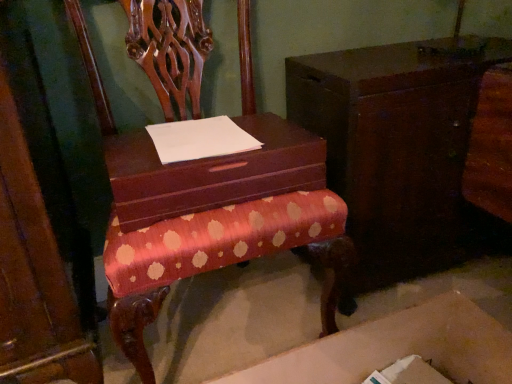
This screenshot has width=512, height=384. What are the coordinates of `matte brown shoe box at center` in the screenshot? It's located at (211, 172).

Measure the distance between point (459, 317) and camera.

They are 37.40 inches apart.

In order to click on wooden cabinet at center in this screenshot , I will do `click(397, 146)`.

Is polished wood chair at center thinner than white paper at center?

No, polished wood chair at center is not thinner than white paper at center.

Relative to white paper at center, is polished wood chair at center in front or behind?

polished wood chair at center is positioned closer to the viewer than white paper at center.

How different are the orientations of polished wood chair at center and white paper at center in degrees?

There is a 1.8-degree angle between the facing directions of polished wood chair at center and white paper at center.

Is polished wood chair at center at the right side of white paper at center?

Yes, polished wood chair at center is to the right of white paper at center.

From a real-world perspective, between polished wood chair at center and cardboard box at lower center, who is vertically lower?

From a 3D spatial view, cardboard box at lower center is below.

Is polished wood chair at center facing away from cardboard box at lower center?

No, polished wood chair at center is not facing the opposite direction of cardboard box at lower center.

Does point (141, 350) come in front of point (368, 367)?

Yes, point (141, 350) is closer to viewer.

Would you say polished wood chair at center is to the left or to the right of cardboard box at lower center in the picture?

In the image, polished wood chair at center appears on the left side of cardboard box at lower center.

Is matte brown shoe box at center far away from wooden cabinet at center?

Actually, matte brown shoe box at center and wooden cabinet at center are a little close together.

Is wooden cabinet at center at the back of matte brown shoe box at center?

matte brown shoe box at center does not have its back to wooden cabinet at center.

Locate an element on the screen. furniture lying behind the matte brown shoe box at center is located at coordinates (397, 146).

How different are the orientations of matte brown shoe box at center and wooden cabinet at center in degrees?

The angle between the facing direction of matte brown shoe box at center and the facing direction of wooden cabinet at center is 1.06 degrees.

Relative to white paper at center, is cardboard box at lower center in front or behind?

In the image, cardboard box at lower center appears in front of white paper at center.

From the picture: Is cardboard box at lower center oriented towards white paper at center?

No, cardboard box at lower center is not aimed at white paper at center.

In the scene shown: From a real-world perspective, which is physically above, cardboard box at lower center or white paper at center?

white paper at center, from a real-world perspective.

Can white paper at center be found inside cardboard box at lower center?

No, white paper at center is located outside of cardboard box at lower center.

Considering the relative positions of white paper at center and polished wood chair at center in the image provided, is white paper at center to the left or to the right of polished wood chair at center?

white paper at center is to the left of polished wood chair at center.

Are white paper at center and polished wood chair at center located far from each other?

They are positioned close to each other.

Does point (211, 142) appear closer or farther from the camera than point (303, 219)?

Clearly, point (211, 142) is more distant from the camera than point (303, 219).

In terms of size, does white paper at center appear bigger or smaller than polished wood chair at center?

Clearly, white paper at center is smaller in size than polished wood chair at center.

Which is more to the right, cardboard box at lower center or matte brown shoe box at center?

cardboard box at lower center is more to the right.

Which object is more forward, cardboard box at lower center or matte brown shoe box at center?

cardboard box at lower center is closer to the camera.

Considering the sizes of objects cardboard box at lower center and matte brown shoe box at center in the image provided, who is wider, cardboard box at lower center or matte brown shoe box at center?

With larger width is matte brown shoe box at center.

Can you tell me how much cardboard box at lower center and matte brown shoe box at center differ in facing direction?

They differ by 0.473 degrees in their facing directions.

Between white paper at center and wooden cabinet at center, which one has larger width?

With larger width is wooden cabinet at center.

Consider the image. From a real-world perspective, which object stands above the other?

From a 3D spatial view, white paper at center is above.

Is white paper at center at the left side of wooden cabinet at center?

Correct, you'll find white paper at center to the left of wooden cabinet at center.

Is white paper at center further to the viewer compared to wooden cabinet at center?

No, it is in front of wooden cabinet at center.

Locate an element on the screen. chair located on the right of white paper at center is located at coordinates (214, 205).

The width and height of the screenshot is (512, 384). Identify the location of chair in front of the cardboard box at lower center. (214, 205).

Based on their spatial positions, is wooden cabinet at center or white paper at center further from matte brown shoe box at center?

wooden cabinet at center is further to matte brown shoe box at center.

Which object lies further to the anchor point wooden cabinet at center, white paper at center or matte brown shoe box at center?

Based on the image, white paper at center appears to be further to wooden cabinet at center.

Considering their positions, is white paper at center positioned closer to matte brown shoe box at center than polished wood chair at center?

white paper at center.

Looking at the image, which one is located closer to matte brown shoe box at center, polished wood chair at center or white paper at center?

Among the two, white paper at center is located nearer to matte brown shoe box at center.

Based on their spatial positions, is matte brown shoe box at center or wooden cabinet at center further from white paper at center?

wooden cabinet at center is further to white paper at center.

Considering their positions, is wooden cabinet at center positioned closer to matte brown shoe box at center than polished wood chair at center?

The object closer to matte brown shoe box at center is polished wood chair at center.

Looking at this image, based on their spatial positions, is cardboard box at lower center or wooden cabinet at center closer to white paper at center?

wooden cabinet at center is closer to white paper at center.

Considering their positions, is polished wood chair at center positioned further to matte brown shoe box at center than cardboard box at lower center?

cardboard box at lower center lies further to matte brown shoe box at center than the other object.

This screenshot has height=384, width=512. I want to click on chair between matte brown shoe box at center and cardboard box at lower center from top to bottom, so click(214, 205).

This screenshot has width=512, height=384. Find the location of `cardboard box located between polished wood chair at center and wooden cabinet at center in the left-right direction`. cardboard box located between polished wood chair at center and wooden cabinet at center in the left-right direction is located at coordinates [x=398, y=348].

The image size is (512, 384). I want to click on shoe box located between white paper at center and wooden cabinet at center in the left-right direction, so click(x=211, y=172).

At what (x,y) coordinates should I click in order to perform the action: click on shoe box between white paper at center and cardboard box at lower center from top to bottom. Please return your answer as a coordinate pair (x, y). Looking at the image, I should click on (211, 172).